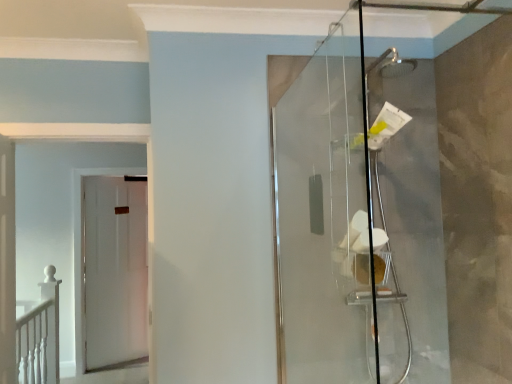
Question: Is transparent glass shower door at right in front of or behind white matte door at left, the 2th door from the front, in the image?

Choices:
 (A) front
 (B) behind

Answer: (A)

Question: Is transparent glass shower door at right inside or outside of white matte door at left, the 2th door from the front?

Choices:
 (A) inside
 (B) outside

Answer: (B)

Question: Which object is the closest to the white matte railing at lower left?

Choices:
 (A) white matte door at left, arranged as the first door when viewed from the front
 (B) white matte door at left, the 2th door from the front
 (C) transparent glass shower door at right

Answer: (A)

Question: Which of these objects is positioned closest to the white matte door at left, which appears as the 1th door when viewed from the back?

Choices:
 (A) white matte railing at lower left
 (B) transparent glass shower door at right
 (C) white matte door at left, the 2th door in the back-to-front sequence

Answer: (A)